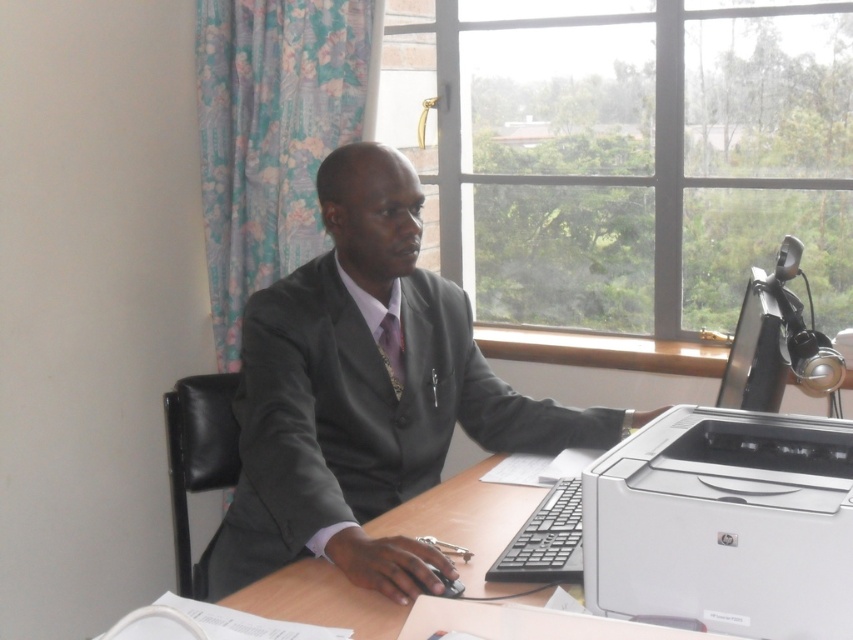
Can you confirm if clear glass window at upper center is bigger than white matte printer at lower right?

Correct, clear glass window at upper center is larger in size than white matte printer at lower right.

I want to click on clear glass window at upper center, so click(625, 154).

Image resolution: width=853 pixels, height=640 pixels. Identify the location of clear glass window at upper center. (625, 154).

Which is more to the right, matte gray suit at center or white matte printer at lower right?

From the viewer's perspective, white matte printer at lower right appears more on the right side.

Can you confirm if matte gray suit at center is bigger than white matte printer at lower right?

Correct, matte gray suit at center is larger in size than white matte printer at lower right.

What do you see at coordinates (364, 396) in the screenshot?
I see `matte gray suit at center` at bounding box center [364, 396].

Where is `matte gray suit at center`? This screenshot has width=853, height=640. matte gray suit at center is located at coordinates (364, 396).

Can you confirm if white matte printer at lower right is shorter than patterned silk tie at center?

In fact, white matte printer at lower right may be taller than patterned silk tie at center.

Which is above, white matte printer at lower right or patterned silk tie at center?

patterned silk tie at center is higher up.

Is point (697, 410) farther from viewer compared to point (393, 365)?

No, it is in front of (393, 365).

This screenshot has width=853, height=640. Find the location of `white matte printer at lower right`. white matte printer at lower right is located at coordinates (724, 524).